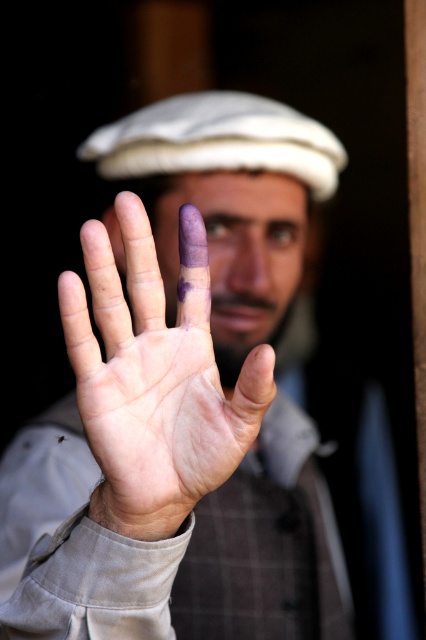
You are an artist trying to paint the scene. You notice the purple matte hand at center and the purple matte palm at center. Which object is located below the other?

The purple matte hand at center is positioned under the purple matte palm at center.

You are a photographer adjusting your camera settings. You notice the purple matte hand at center in your frame. Based on its position, can you estimate its coordinates in the image? Please provide the coordinates as a point in the format like point 0.5,0.5.

The purple matte hand at center is located at point (181, 397).

You are a photographer adjusting your camera settings to capture a closeup of the purple matte hand at center. The camera has a focal length of 100mm and an aperture of f2.8. To ensure the hand is in focus, what distance should you set the focus ring to?

The purple matte hand at center is 3.68 feet from camera, so you should set the focus ring to 3.68 feet to ensure the hand is in focus.